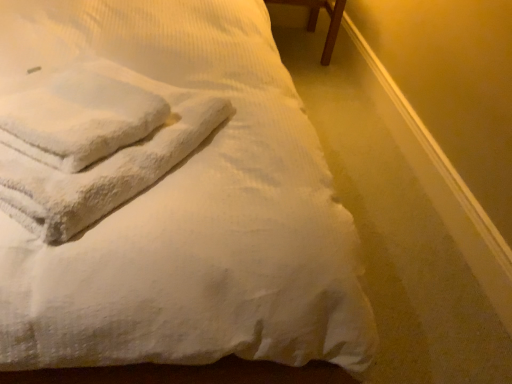
Question: Does white soft towel at upper left have a greater height compared to brown wooden table at upper right?

Choices:
 (A) yes
 (B) no

Answer: (A)

Question: Is white soft towel at upper left bigger than brown wooden table at upper right?

Choices:
 (A) no
 (B) yes

Answer: (B)

Question: Does white soft towel at upper left appear on the left side of brown wooden table at upper right?

Choices:
 (A) yes
 (B) no

Answer: (A)

Question: Does white soft towel at upper left have a lesser width compared to brown wooden table at upper right?

Choices:
 (A) no
 (B) yes

Answer: (A)

Question: Is white soft towel at upper left oriented away from brown wooden table at upper right?

Choices:
 (A) yes
 (B) no

Answer: (B)

Question: Considering the positions of point (74, 145) and point (120, 167), is point (74, 145) closer or farther from the camera than point (120, 167)?

Choices:
 (A) farther
 (B) closer

Answer: (B)

Question: Considering the positions of white fluffy towel at upper left, positioned as the 2th bath towel in left-to-right order, and white fluffy bath towel at upper left, placed as the second bath towel when sorted from right to left, in the image, is white fluffy towel at upper left, positioned as the 2th bath towel in left-to-right order, taller or shorter than white fluffy bath towel at upper left, placed as the second bath towel when sorted from right to left,?

Choices:
 (A) short
 (B) tall

Answer: (A)

Question: In the image, is white fluffy towel at upper left, positioned as the 2th bath towel in left-to-right order, positioned in front of or behind white fluffy bath towel at upper left, placed as the second bath towel when sorted from right to left?

Choices:
 (A) front
 (B) behind

Answer: (B)

Question: Is white fluffy towel at upper left, positioned as the 2th bath towel in left-to-right order, spatially inside white fluffy bath towel at upper left, which is the first bath towel from left to right, or outside of it?

Choices:
 (A) outside
 (B) inside

Answer: (B)

Question: Would you say white soft towel at upper left is to the left or to the right of white fluffy towel at upper left, the first bath towel positioned from the right, in the picture?

Choices:
 (A) left
 (B) right

Answer: (A)

Question: Is white soft towel at upper left in front of or behind white fluffy towel at upper left, positioned as the 2th bath towel in left-to-right order, in the image?

Choices:
 (A) front
 (B) behind

Answer: (A)

Question: Is white soft towel at upper left taller or shorter than white fluffy towel at upper left, positioned as the 2th bath towel in left-to-right order?

Choices:
 (A) short
 (B) tall

Answer: (B)

Question: Considering the positions of point (249, 220) and point (30, 102), is point (249, 220) closer or farther from the camera than point (30, 102)?

Choices:
 (A) farther
 (B) closer

Answer: (B)

Question: In the image, is white fluffy bath towel at upper left, which is the first bath towel from left to right, positioned in front of or behind white soft towel at upper left?

Choices:
 (A) behind
 (B) front

Answer: (A)

Question: Is white fluffy bath towel at upper left, placed as the second bath towel when sorted from right to left, taller or shorter than white soft towel at upper left?

Choices:
 (A) tall
 (B) short

Answer: (B)